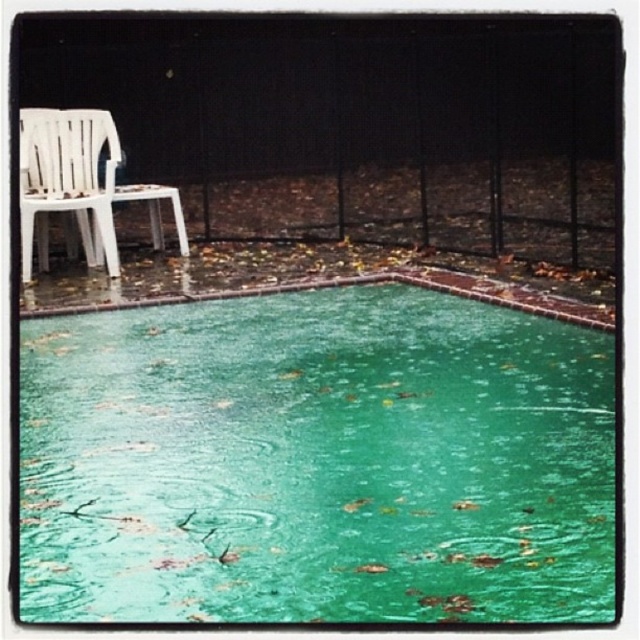
Question: Which object is the farthest from the black metal fence at upper center?

Choices:
 (A) green glossy water at center
 (B) white plastic chair at left

Answer: (A)

Question: Among these objects, which one is farthest from the camera?

Choices:
 (A) white plastic chair at left
 (B) green glossy water at center

Answer: (A)

Question: Which of the following is the closest to the observer?

Choices:
 (A) (348, 168)
 (B) (102, 144)

Answer: (B)

Question: Does green glossy water at center appear on the right side of white plastic chair at left?

Choices:
 (A) no
 (B) yes

Answer: (B)

Question: Is green glossy water at center positioned at the back of black metal fence at upper center?

Choices:
 (A) no
 (B) yes

Answer: (A)

Question: Where is green glossy water at center located in relation to black metal fence at upper center in the image?

Choices:
 (A) above
 (B) below

Answer: (B)